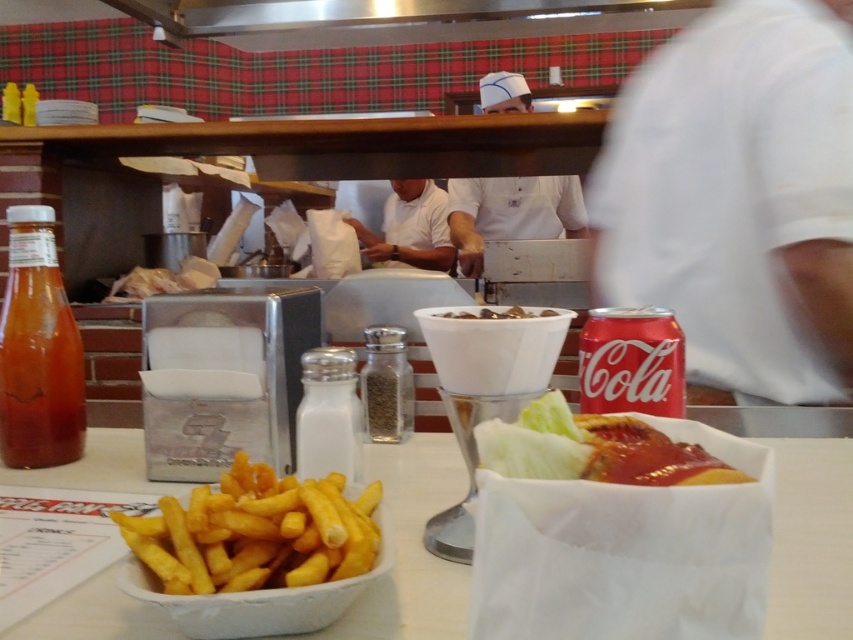
You are a customer at the diner and want to place your phone on the table. You see the shiny plastic basket at center and the white uniform at center. Which object can you place your phone on?

The shiny plastic basket at center has a smaller size compared to white uniform at center, so the phone can be placed on the shiny plastic basket at center.

You are a customer at the diner and want to grab the golden crispy french fries at lower left without knocking over the translucent glass can at left. Which direction should you move your hand to reach the fries first?

The golden crispy french fries at lower left is located below the translucent glass can at left, so you should move your hand downward to reach the fries first.

You are a customer at this diner and want to place your phone on the table. The white uniform at center and brown matte bowl at center are currently on the table. Which object should you move to make space for your phone?

The white uniform at center is bigger than the brown matte bowl at center, so you should move the brown matte bowl at center to make space for your phone.